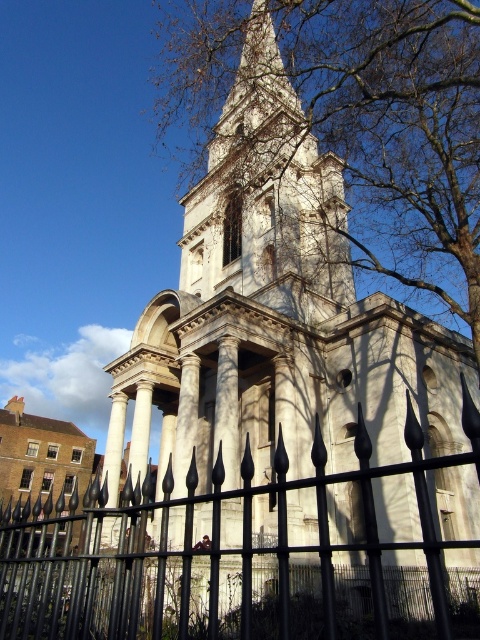
Question: Considering the real-world distances, which object is closest to the bare branches at upper center?

Choices:
 (A) black wrought iron fence at lower left
 (B) white stone bell tower at upper center

Answer: (B)

Question: Can you confirm if black wrought iron fence at lower left is wider than white stone bell tower at upper center?

Choices:
 (A) yes
 (B) no

Answer: (A)

Question: Which of the following is the closest to the observer?

Choices:
 (A) (428, 216)
 (B) (242, 182)
 (C) (211, 593)

Answer: (C)

Question: Is bare branches at upper center to the left of black wrought iron fence at lower left from the viewer's perspective?

Choices:
 (A) no
 (B) yes

Answer: (A)

Question: Can you confirm if bare branches at upper center is thinner than white stone bell tower at upper center?

Choices:
 (A) no
 (B) yes

Answer: (A)

Question: Which object appears farthest from the camera in this image?

Choices:
 (A) bare branches at upper center
 (B) black wrought iron fence at lower left
 (C) white stone bell tower at upper center

Answer: (C)